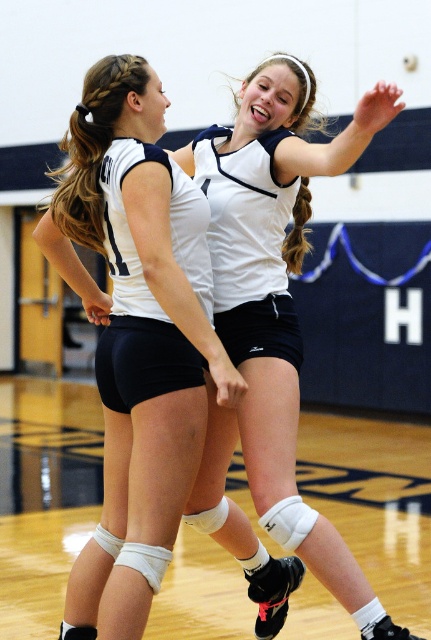
Question: Can you confirm if white matte volleyball jersey at center is positioned to the left of white matte volleyball at center?

Choices:
 (A) no
 (B) yes

Answer: (B)

Question: Which object appears closest to the camera in this image?

Choices:
 (A) white matte volleyball at center
 (B) white matte volleyball jersey at center

Answer: (A)

Question: Can you confirm if white matte volleyball jersey at center is thinner than white matte volleyball at center?

Choices:
 (A) yes
 (B) no

Answer: (A)

Question: Can you confirm if white matte volleyball jersey at center is positioned to the left of white matte volleyball at center?

Choices:
 (A) no
 (B) yes

Answer: (B)